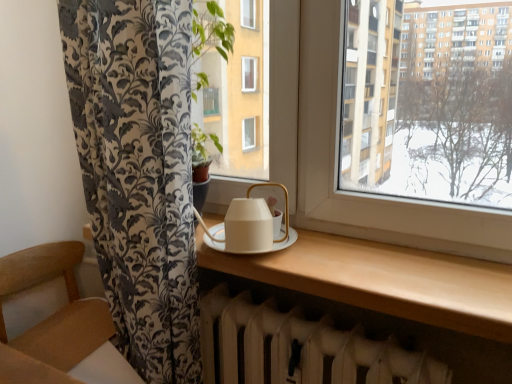
Question: Is white matte tea set at center outside of matte white table at center?

Choices:
 (A) yes
 (B) no

Answer: (A)

Question: Does white matte tea set at center touch matte white table at center?

Choices:
 (A) yes
 (B) no

Answer: (B)

Question: Is the depth of white matte tea set at center less than that of matte white table at center?

Choices:
 (A) yes
 (B) no

Answer: (B)

Question: From the image's perspective, would you say white matte tea set at center is positioned over matte white table at center?

Choices:
 (A) no
 (B) yes

Answer: (B)

Question: Does white matte tea set at center have a larger size compared to matte white table at center?

Choices:
 (A) no
 (B) yes

Answer: (A)

Question: Is matte white table at center to the left or to the right of wooden armchair at lower left in the image?

Choices:
 (A) right
 (B) left

Answer: (A)

Question: From a real-world perspective, is matte white table at center physically located above or below wooden armchair at lower left?

Choices:
 (A) below
 (B) above

Answer: (B)

Question: Is matte white table at center situated inside wooden armchair at lower left or outside?

Choices:
 (A) outside
 (B) inside

Answer: (A)

Question: From the image's perspective, is matte white table at center above or below wooden armchair at lower left?

Choices:
 (A) above
 (B) below

Answer: (A)

Question: Looking at the image, does white matte tea set at center seem bigger or smaller compared to matte white table at center?

Choices:
 (A) small
 (B) big

Answer: (A)

Question: Looking at their shapes, would you say white matte tea set at center is wider or thinner than matte white table at center?

Choices:
 (A) wide
 (B) thin

Answer: (B)

Question: From a real-world perspective, is white matte tea set at center above or below matte white table at center?

Choices:
 (A) below
 (B) above

Answer: (B)

Question: Does point (266, 248) appear closer or farther from the camera than point (486, 306)?

Choices:
 (A) closer
 (B) farther

Answer: (B)

Question: Considering the positions of point (286, 354) and point (268, 210), is point (286, 354) closer or farther from the camera than point (268, 210)?

Choices:
 (A) farther
 (B) closer

Answer: (A)

Question: Looking at their shapes, would you say white matte radiator at lower center is wider or thinner than white matte tea set at center?

Choices:
 (A) wide
 (B) thin

Answer: (B)